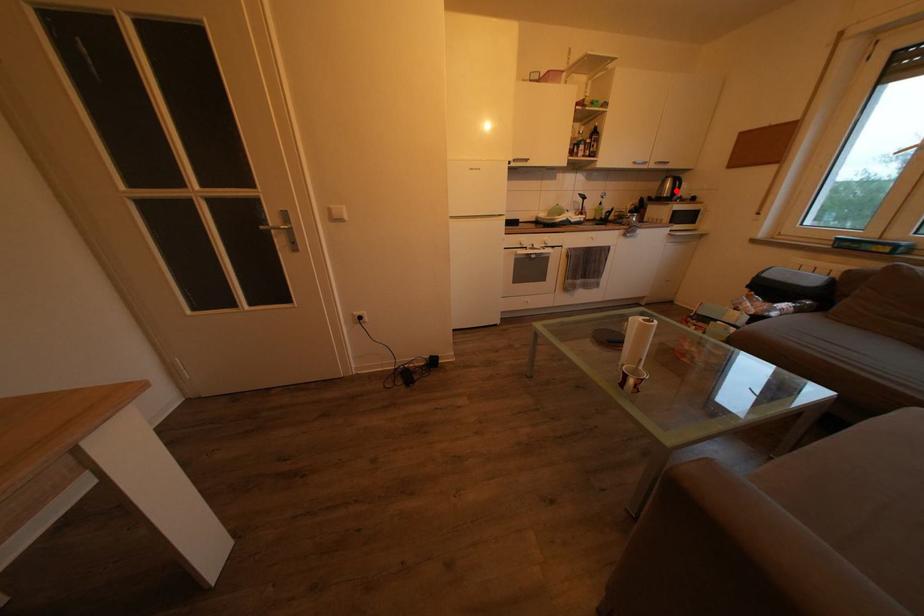
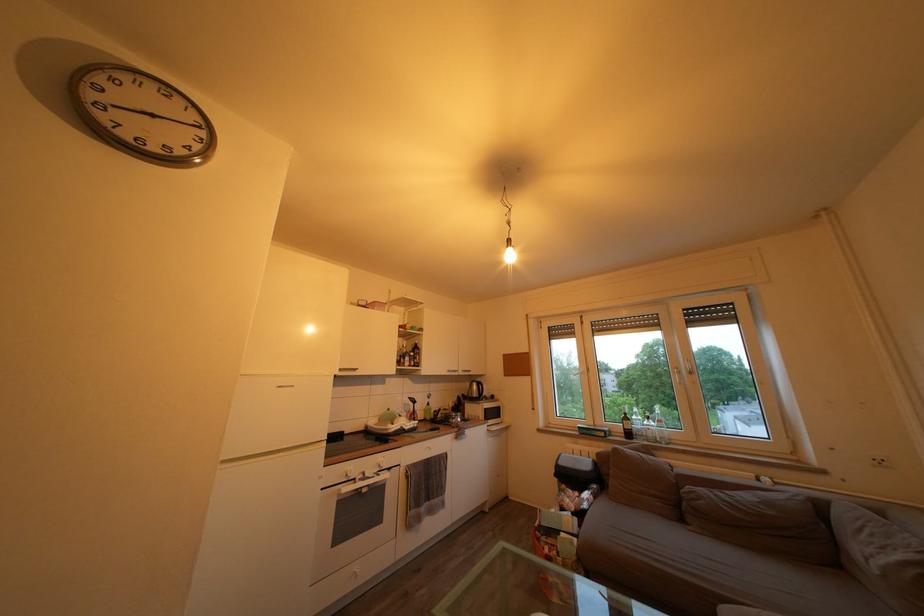
Where in the second image is the point corresponding to the highlighted location from the first image?

(482, 392)